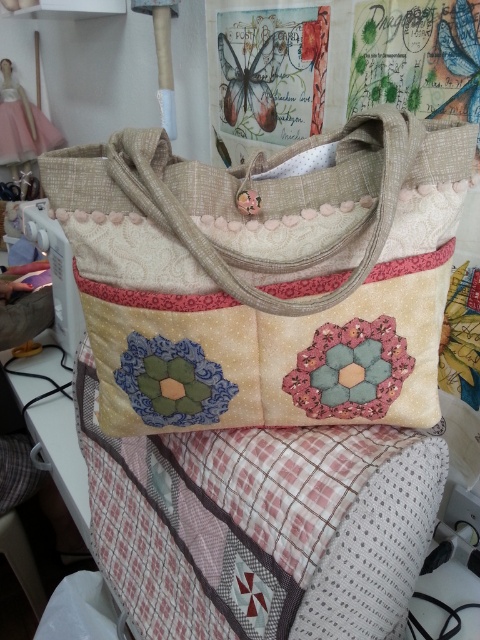
How far apart are patchwork fabric quilt at center and textured beige shoulder bag at center?

11.48 inches

Is patchwork fabric quilt at center taller than textured beige shoulder bag at center?

Indeed, patchwork fabric quilt at center has a greater height compared to textured beige shoulder bag at center.

Locate an element on the screen. The image size is (480, 640). patchwork fabric quilt at center is located at coordinates (261, 525).